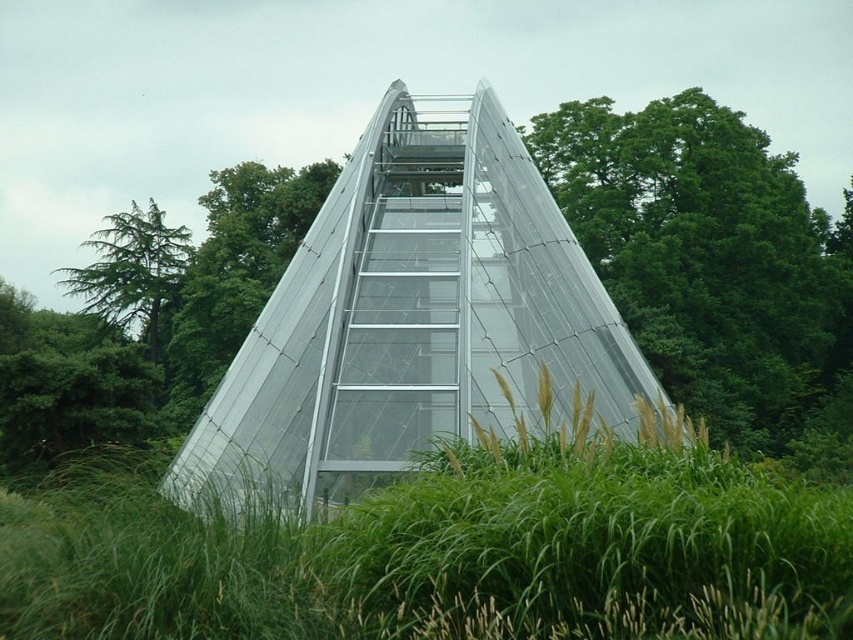
You are standing in front of the triangular greenhouse and notice two green leafy trees. One is labeled as green leafy tree at upper right and the other as green leafy tree at left. Which tree is positioned higher up in the image?

The green leafy tree at upper right is positioned higher up in the image than the green leafy tree at left.

You are standing at the base of the triangular greenhouse and looking towards the dense trees in the background. There is a point labeled as point [711,260] on the image. What does this point indicate?

The point [711,260] indicates the location of a green leafy tree at the upper right of the image.